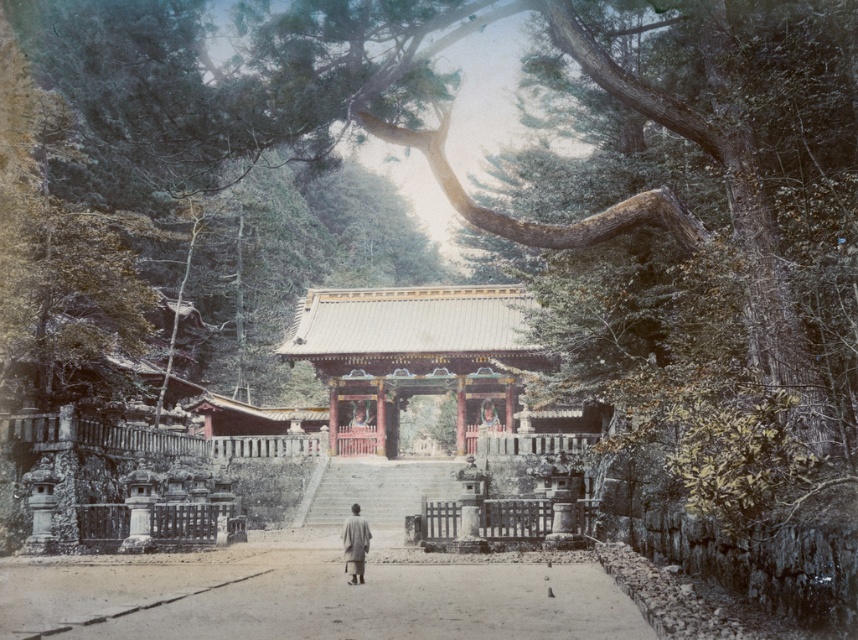
You are standing at the entrance of a traditional Japanese shrine and want to walk towards the torii gate. The path is marked by a point at coordinates point (313, 600). What type of terrain will you be walking on?

The point (313, 600) indicates smooth sand path at center, so you will be walking on a smooth sand path.

You are standing at the entrance of the temple and want to walk towards the torii gate. According to the image, which direction should you head to follow the smooth sand path at center?

The smooth sand path at center is located at point (313, 600), so you should head towards that direction to follow the path towards the torii gate.

From the picture: You are a visitor at the temple and want to walk along the path. Can you tell me which one is larger in size between the smooth sand path at center and the gray woolen robe at center?

The smooth sand path at center is bigger than gray woolen robe at center.